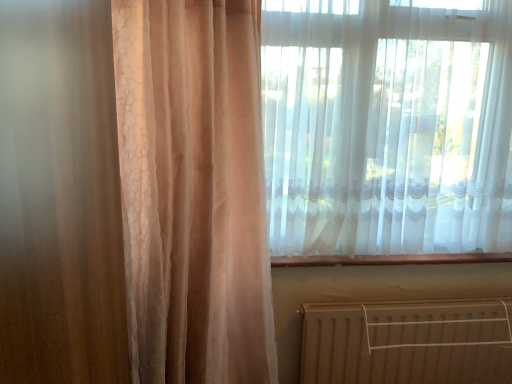
Question: Considering the positions of point (391, 244) and point (312, 307), is point (391, 244) closer or farther from the camera than point (312, 307)?

Choices:
 (A) closer
 (B) farther

Answer: (B)

Question: Looking at their shapes, would you say white sheer curtain at upper right is wider or thinner than brown metallic radiator at lower right?

Choices:
 (A) wide
 (B) thin

Answer: (A)

Question: From a real-world perspective, relative to brown metallic radiator at lower right, is white sheer curtain at upper right vertically above or below?

Choices:
 (A) above
 (B) below

Answer: (A)

Question: Is brown metallic radiator at lower right bigger or smaller than white sheer curtain at upper right?

Choices:
 (A) big
 (B) small

Answer: (B)

Question: Is point (463, 332) positioned closer to the camera than point (287, 124)?

Choices:
 (A) closer
 (B) farther

Answer: (B)

Question: Considering their positions, is brown metallic radiator at lower right located in front of or behind white sheer curtain at upper right?

Choices:
 (A) behind
 (B) front

Answer: (A)

Question: From a real-world perspective, is brown metallic radiator at lower right physically located above or below white sheer curtain at upper right?

Choices:
 (A) below
 (B) above

Answer: (A)